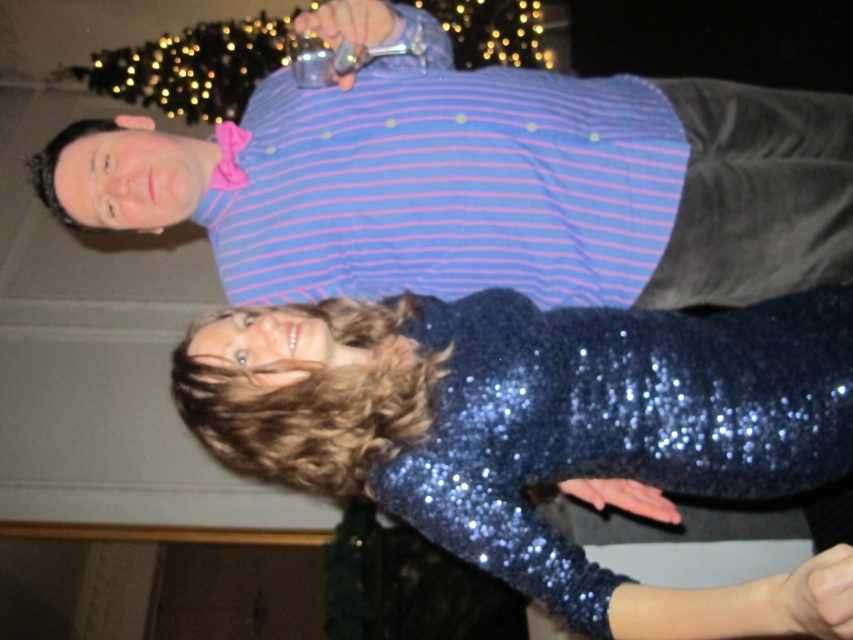
In the scene shown: Based on the rotated image, if you want to reach the sparkly blue dress at center without moving the blue striped shirt at upper center, which direction should you approach from?

The sparkly blue dress at center is behind the blue striped shirt at upper center, so you should approach from the front side of the blue striped shirt at upper center to reach the sparkly blue dress at center without moving it.

You are a photographer trying to capture a portrait of the blue striped shirt at upper center and the sparkly blue dress at center. Since the image is rotated, you need to adjust your camera angle. Considering their heights, which subject should you focus on first to ensure both are in frame?

The blue striped shirt at upper center is much taller than the sparkly blue dress at center, so you should focus on the blue striped shirt at upper center first to ensure the entire height of both subjects fits within the frame.

You are a photographer trying to capture the scene from the original orientation. Based on the rotated image, where is the blue striped shirt at upper center relative to the sparkly blue dress at center?

The blue striped shirt at upper center is to the left of the sparkly blue dress at center in the rotated image.